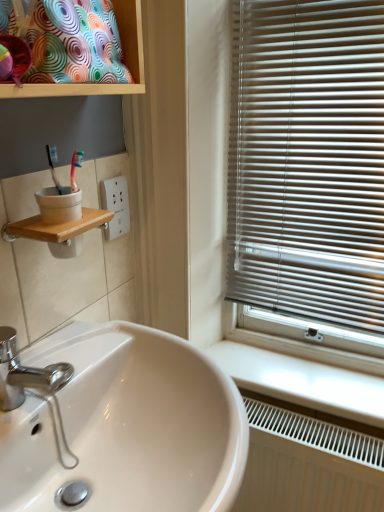
Identify the location of free spot above white textured radiator at lower right (from a real-world perspective). (307, 418).